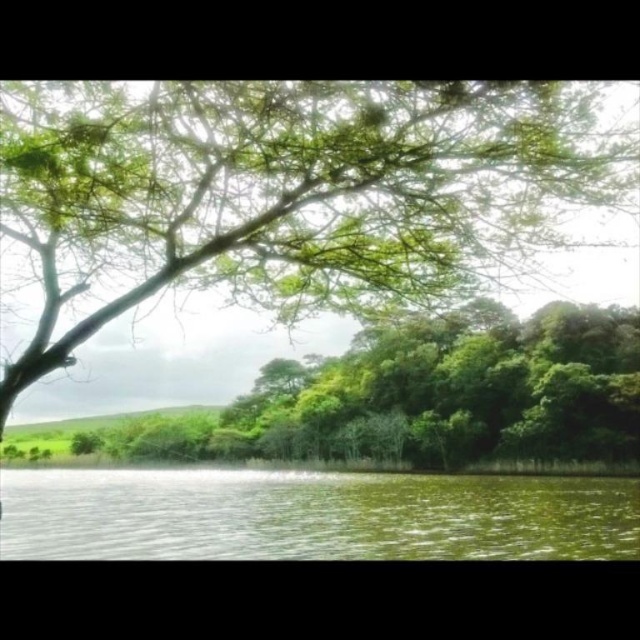
Who is positioned more to the right, green leafy tree at upper left or green liquid at lower center?

green leafy tree at upper left is more to the right.

Which is behind, point (492, 86) or point (38, 522)?

Point (38, 522)

Which is in front, point (541, 131) or point (362, 509)?

Positioned in front is point (541, 131).

Where is `green leafy tree at upper left`? The image size is (640, 640). green leafy tree at upper left is located at coordinates (288, 196).